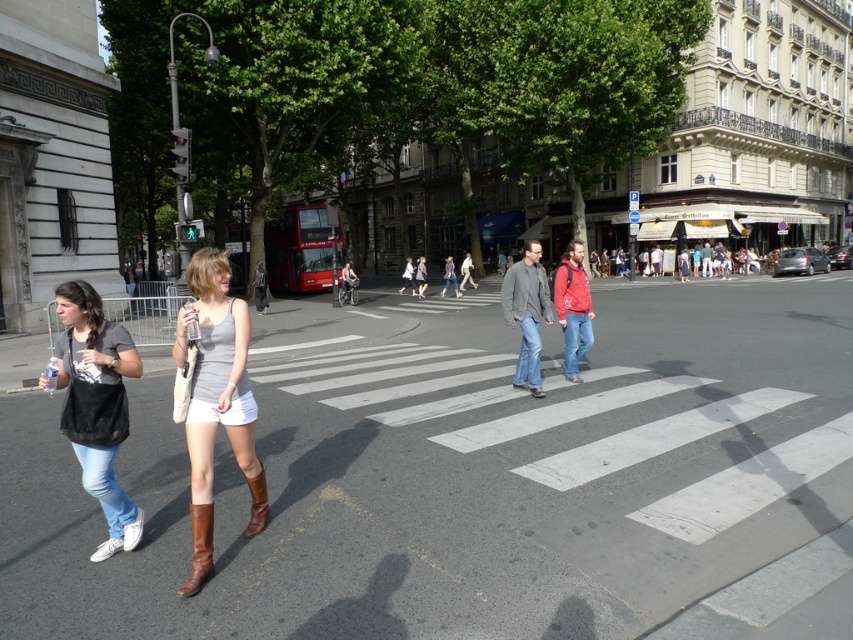
Between gray matte tank top at center and brown leather boot at lower center, which one appears on the right side from the viewer's perspective?

From the viewer's perspective, brown leather boot at lower center appears more on the right side.

Is gray matte tank top at center behind brown leather boot at lower center?

No, it is not.

Between point (230, 339) and point (247, 528), which one is positioned behind?

The point (247, 528) is behind.

You are a GUI agent. You are given a task and a screenshot of the screen. Output one action in this format:
    pyautogui.click(x=<x>, y=<y>)
    Task: Click on the gray matte tank top at center
    This screenshot has width=853, height=640.
    Given the screenshot: What is the action you would take?
    pyautogui.click(x=216, y=401)

Does matte black bag at left appear on the right side of brown leather boot at lower left?

Incorrect, matte black bag at left is not on the right side of brown leather boot at lower left.

Between matte black bag at left and brown leather boot at lower left, which one appears on the left side from the viewer's perspective?

Positioned to the left is matte black bag at left.

Which is in front, point (74, 310) or point (187, 580)?

Point (187, 580) is more forward.

This screenshot has height=640, width=853. In order to click on matte black bag at left in this screenshot , I will do `click(96, 404)`.

Does gray matte tank top at center come in front of matte black bag at left?

No.

Can you confirm if gray matte tank top at center is thinner than matte black bag at left?

Yes, gray matte tank top at center is thinner than matte black bag at left.

Is point (190, 280) positioned after point (136, 522)?

No, it is not.

The image size is (853, 640). In order to click on gray matte tank top at center in this screenshot , I will do `click(216, 401)`.